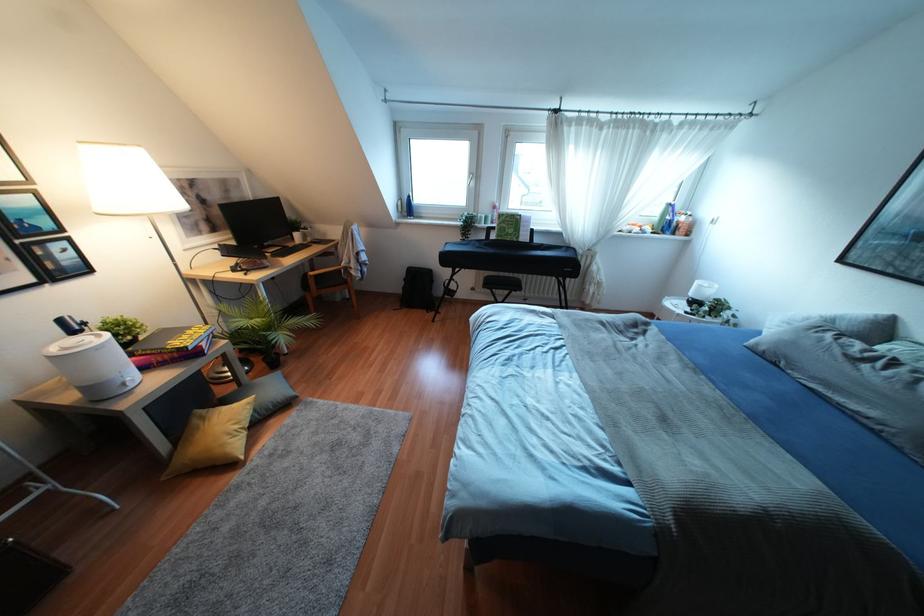
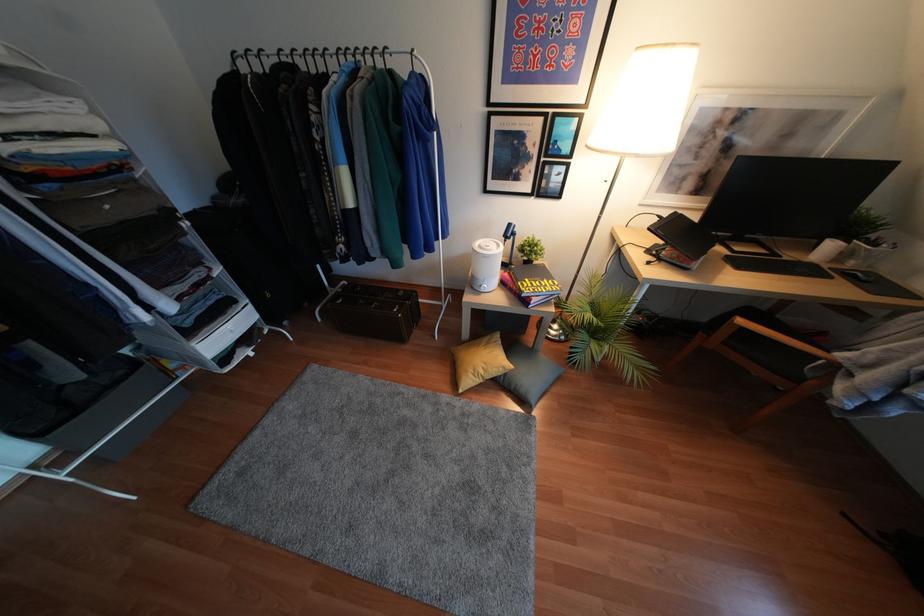
In the second image, find the point that corresponds to pixel 236 426 in the first image.

(480, 371)